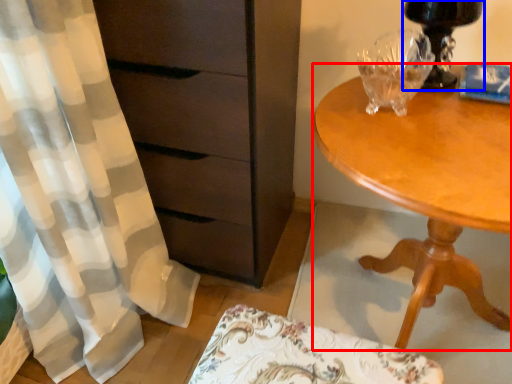
Question: Which object is closer to the camera taking this photo, desk (highlighted by a red box) or table lamp (highlighted by a blue box)?

Choices:
 (A) desk
 (B) table lamp

Answer: (A)